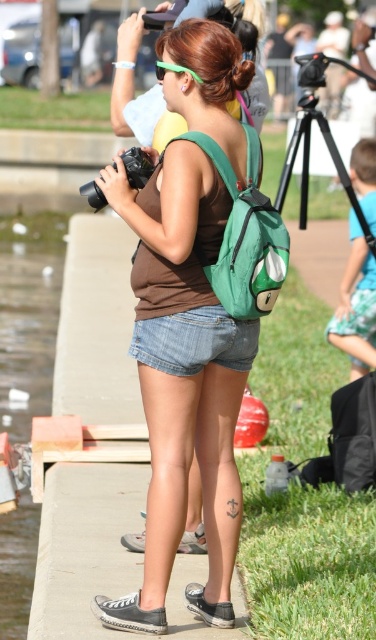
Question: Does clear water at lower left lie in front of denim shorts at center?

Choices:
 (A) yes
 (B) no

Answer: (B)

Question: Which point is closer to the camera?

Choices:
 (A) clear water at lower left
 (B) matte green backpack at center
 (C) gray canvas sneaker at lower center

Answer: (B)

Question: Does matte green backpack at center appear on the left side of black rubber camera at center?

Choices:
 (A) yes
 (B) no

Answer: (B)

Question: Which point is farther to the camera?

Choices:
 (A) (28, 516)
 (B) (221, 605)
 (C) (216, 308)

Answer: (A)

Question: Is clear water at lower left positioned behind denim shorts at center?

Choices:
 (A) yes
 (B) no

Answer: (A)

Question: Which object is the closest to the black rubber camera at center?

Choices:
 (A) denim shorts at center
 (B) gray canvas sneaker at lower center

Answer: (A)